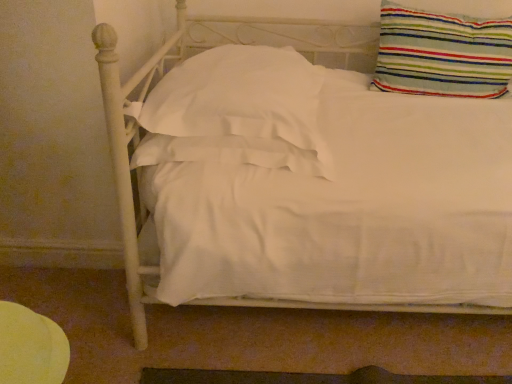
In order to click on striped fabric pillow at upper right, the second pillow viewed from the left in this screenshot , I will do `click(442, 54)`.

What do you see at coordinates (442, 54) in the screenshot?
I see `striped fabric pillow at upper right, the second pillow viewed from the left` at bounding box center [442, 54].

What is the approximate width of striped fabric pillow at upper right, the 1th pillow viewed from the right?

striped fabric pillow at upper right, the 1th pillow viewed from the right, is 8.17 inches in width.

Identify the location of white satin pillow at center, arranged as the 2th pillow when viewed from the right. The height and width of the screenshot is (384, 512). (236, 112).

Describe the element at coordinates (236, 112) in the screenshot. I see `white satin pillow at center, arranged as the 2th pillow when viewed from the right` at that location.

Where is `striped fabric pillow at upper right, the 1th pillow viewed from the right`? The image size is (512, 384). striped fabric pillow at upper right, the 1th pillow viewed from the right is located at coordinates (442, 54).

In the image, is striped fabric pillow at upper right, the second pillow viewed from the left, on the left side or the right side of white satin pillow at center, arranged as the 2th pillow when viewed from the right?

Based on their positions, striped fabric pillow at upper right, the second pillow viewed from the left, is located to the right of white satin pillow at center, arranged as the 2th pillow when viewed from the right.

Based on the photo, considering their positions, is striped fabric pillow at upper right, the 1th pillow viewed from the right, located in front of or behind white satin pillow at center, which is the 1th pillow from left to right?

In the image, striped fabric pillow at upper right, the 1th pillow viewed from the right, appears behind white satin pillow at center, which is the 1th pillow from left to right.

Considering the points (434, 60) and (219, 86), which point is behind, point (434, 60) or point (219, 86)?

The point (434, 60) is farther.

From the image's perspective, would you say striped fabric pillow at upper right, the 1th pillow viewed from the right, is positioned over white satin pillow at center, arranged as the 2th pillow when viewed from the right?

Yes, from the image's perspective, striped fabric pillow at upper right, the 1th pillow viewed from the right, is above white satin pillow at center, arranged as the 2th pillow when viewed from the right.

From a real-world perspective, which is physically below, striped fabric pillow at upper right, the second pillow viewed from the left, or white satin pillow at center, which is the 1th pillow from left to right?

white satin pillow at center, which is the 1th pillow from left to right, from a real-world perspective.

Considering the sizes of objects striped fabric pillow at upper right, the second pillow viewed from the left, and white satin pillow at center, which is the 1th pillow from left to right, in the image provided, who is thinner, striped fabric pillow at upper right, the second pillow viewed from the left, or white satin pillow at center, which is the 1th pillow from left to right,?

Thinner between the two is striped fabric pillow at upper right, the second pillow viewed from the left.

Does striped fabric pillow at upper right, the 1th pillow viewed from the right, have a lesser height compared to white satin pillow at center, arranged as the 2th pillow when viewed from the right?

Incorrect, the height of striped fabric pillow at upper right, the 1th pillow viewed from the right, does not fall short of that of white satin pillow at center, arranged as the 2th pillow when viewed from the right.

Is striped fabric pillow at upper right, the second pillow viewed from the left, smaller than white satin pillow at center, which is the 1th pillow from left to right?

Correct, striped fabric pillow at upper right, the second pillow viewed from the left, occupies less space than white satin pillow at center, which is the 1th pillow from left to right.

From the picture: Which is correct: striped fabric pillow at upper right, the second pillow viewed from the left, is inside white satin pillow at center, which is the 1th pillow from left to right, or outside of it?

The correct answer is: outside.

Is striped fabric pillow at upper right, the second pillow viewed from the left, positioned far away from white satin pillow at center, which is the 1th pillow from left to right?

No, there isn't a large distance between striped fabric pillow at upper right, the second pillow viewed from the left, and white satin pillow at center, which is the 1th pillow from left to right.

Is striped fabric pillow at upper right, the second pillow viewed from the left, oriented towards white satin pillow at center, which is the 1th pillow from left to right?

No.

How far apart are striped fabric pillow at upper right, the second pillow viewed from the left, and white satin pillow at center, arranged as the 2th pillow when viewed from the right?

The distance of striped fabric pillow at upper right, the second pillow viewed from the left, from white satin pillow at center, arranged as the 2th pillow when viewed from the right, is 27.78 inches.

Identify the location of pillow on the left of the striped fabric pillow at upper right, the 1th pillow viewed from the right. The image size is (512, 384). (236, 112).

Between white satin pillow at center, arranged as the 2th pillow when viewed from the right, and striped fabric pillow at upper right, the 1th pillow viewed from the right, which one appears on the left side from the viewer's perspective?

From the viewer's perspective, white satin pillow at center, arranged as the 2th pillow when viewed from the right, appears more on the left side.

Considering the positions of objects white satin pillow at center, which is the 1th pillow from left to right, and striped fabric pillow at upper right, the second pillow viewed from the left, in the image provided, who is behind, white satin pillow at center, which is the 1th pillow from left to right, or striped fabric pillow at upper right, the second pillow viewed from the left,?

striped fabric pillow at upper right, the second pillow viewed from the left.

Considering the positions of points (170, 98) and (379, 77), is point (170, 98) closer to camera compared to point (379, 77)?

Yes, point (170, 98) is in front of point (379, 77).

From the image's perspective, relative to striped fabric pillow at upper right, the second pillow viewed from the left, is white satin pillow at center, arranged as the 2th pillow when viewed from the right, above or below?

white satin pillow at center, arranged as the 2th pillow when viewed from the right, is situated lower than striped fabric pillow at upper right, the second pillow viewed from the left, in the image.

From a real-world perspective, is white satin pillow at center, which is the 1th pillow from left to right, above or below striped fabric pillow at upper right, the second pillow viewed from the left?

From a real-world perspective, white satin pillow at center, which is the 1th pillow from left to right, is physically below striped fabric pillow at upper right, the second pillow viewed from the left.

Which object is wider, white satin pillow at center, arranged as the 2th pillow when viewed from the right, or striped fabric pillow at upper right, the 1th pillow viewed from the right?

white satin pillow at center, arranged as the 2th pillow when viewed from the right, is wider.

Is white satin pillow at center, arranged as the 2th pillow when viewed from the right, taller than striped fabric pillow at upper right, the second pillow viewed from the left?

No, white satin pillow at center, arranged as the 2th pillow when viewed from the right, is not taller than striped fabric pillow at upper right, the second pillow viewed from the left.

Considering the relative sizes of white satin pillow at center, which is the 1th pillow from left to right, and striped fabric pillow at upper right, the second pillow viewed from the left, in the image provided, is white satin pillow at center, which is the 1th pillow from left to right, bigger than striped fabric pillow at upper right, the second pillow viewed from the left,?

Correct, white satin pillow at center, which is the 1th pillow from left to right, is larger in size than striped fabric pillow at upper right, the second pillow viewed from the left.

Is striped fabric pillow at upper right, the second pillow viewed from the left, surrounded by white satin pillow at center, which is the 1th pillow from left to right?

No, striped fabric pillow at upper right, the second pillow viewed from the left, is not inside white satin pillow at center, which is the 1th pillow from left to right.

Does white satin pillow at center, which is the 1th pillow from left to right, touch striped fabric pillow at upper right, the 1th pillow viewed from the right?

They are not placed beside each other.

Is white satin pillow at center, which is the 1th pillow from left to right, aimed at striped fabric pillow at upper right, the 1th pillow viewed from the right?

No, white satin pillow at center, which is the 1th pillow from left to right, is not facing towards striped fabric pillow at upper right, the 1th pillow viewed from the right.

How many degrees apart are the facing directions of white satin pillow at center, which is the 1th pillow from left to right, and striped fabric pillow at upper right, the second pillow viewed from the left?

The facing directions of white satin pillow at center, which is the 1th pillow from left to right, and striped fabric pillow at upper right, the second pillow viewed from the left, are 2.56 degrees apart.

How much distance is there between white satin pillow at center, which is the 1th pillow from left to right, and striped fabric pillow at upper right, the second pillow viewed from the left?

The distance of white satin pillow at center, which is the 1th pillow from left to right, from striped fabric pillow at upper right, the second pillow viewed from the left, is 27.78 inches.

What are the coordinates of `pillow on the right of white satin pillow at center, which is the 1th pillow from left to right` in the screenshot? It's located at (442, 54).

Identify the location of pillow below the striped fabric pillow at upper right, the 1th pillow viewed from the right (from the image's perspective). (236, 112).

I want to click on pillow lying behind the white satin pillow at center, which is the 1th pillow from left to right, so click(442, 54).